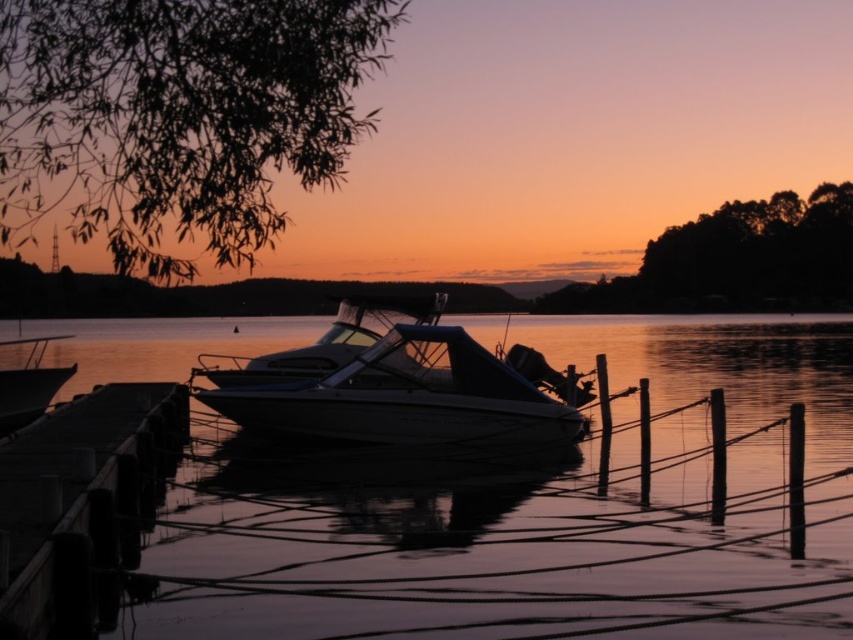
Question: Is white glossy boat at center further to the viewer compared to smooth wood dock at lower left?

Choices:
 (A) no
 (B) yes

Answer: (B)

Question: Which point is farther to the camera?

Choices:
 (A) (210, 458)
 (B) (103, 493)
 (C) (401, 364)
 (D) (19, 424)

Answer: (D)

Question: Which point is closer to the camera?

Choices:
 (A) glossy water at center
 (B) smooth wood dock at lower left
 (C) matte white boat at left
 (D) white glossy boat at center

Answer: (B)

Question: In this image, where is glossy water at center located relative to white glossy boat at center?

Choices:
 (A) above
 (B) below

Answer: (B)

Question: Among these points, which one is nearest to the camera?

Choices:
 (A) (279, 413)
 (B) (62, 333)
 (C) (74, 586)
 (D) (686, 602)

Answer: (C)

Question: Can you confirm if smooth wood dock at lower left is positioned above matte white boat at left?

Choices:
 (A) yes
 (B) no

Answer: (B)